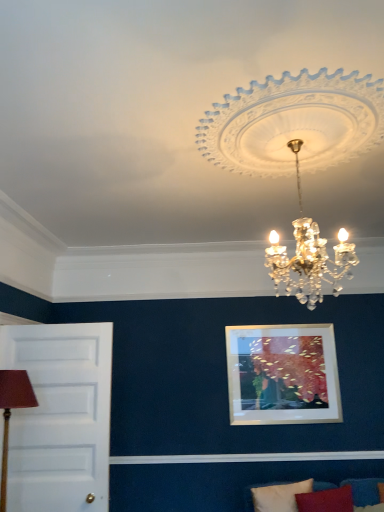
Question: Considering the positions of point (357, 489) and point (233, 168), is point (357, 489) closer or farther from the camera than point (233, 168)?

Choices:
 (A) farther
 (B) closer

Answer: (A)

Question: In the image, is velvet blue couch at lower right positioned in front of or behind white crystal chandelier at upper center?

Choices:
 (A) front
 (B) behind

Answer: (B)

Question: Based on their relative distances, which object is farther from the white crystal chandelier at upper center?

Choices:
 (A) velvet blue couch at lower right
 (B) white fabric pillow at lower right
 (C) white painted wood door at left
 (D) brown fabric lampshade at left

Answer: (A)

Question: Which is nearer to the white painted wood door at left?

Choices:
 (A) velvet blue couch at lower right
 (B) white crystal chandelier at upper center
 (C) white fabric pillow at lower right
 (D) brown fabric lampshade at left

Answer: (D)